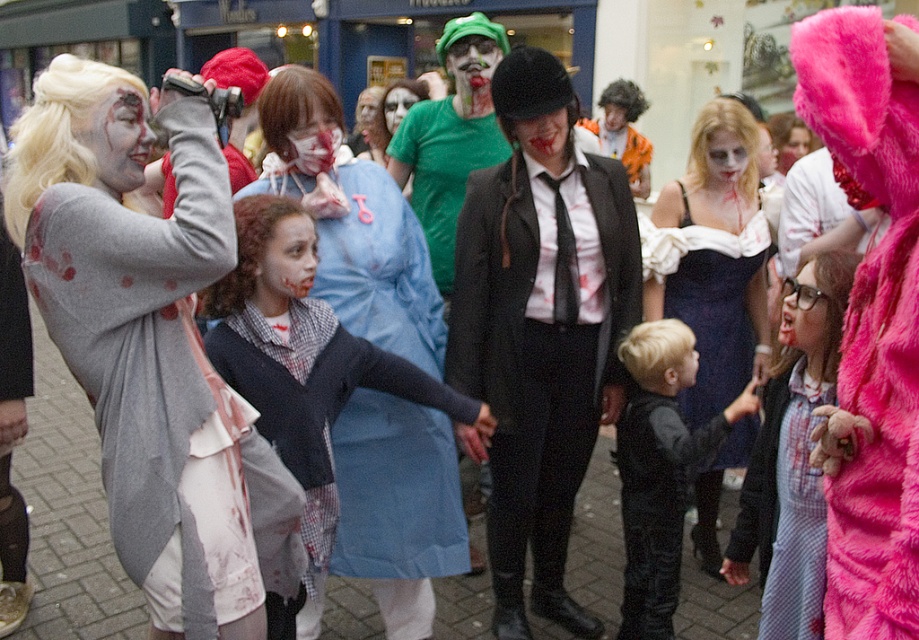
Identify the location of green matte shirt at center. (450, 136).

Between point (418, 115) and point (798, 605), which one is positioned behind?

The point (418, 115) is behind.

I want to click on green matte shirt at center, so click(x=450, y=136).

Does point (135, 289) come behind point (280, 176)?

That is False.

Does matte gray sweater at left have a larger size compared to matte blue dress at center?

No.

In order to click on matte gray sweater at left in this screenshot , I will do `click(143, 333)`.

What are the coordinates of `matte gray sweater at left` in the screenshot? It's located at (143, 333).

Between point (313, 189) and point (793, 552), which one is positioned behind?

Point (313, 189)

The image size is (919, 640). I want to click on matte blue dress at center, so click(x=352, y=221).